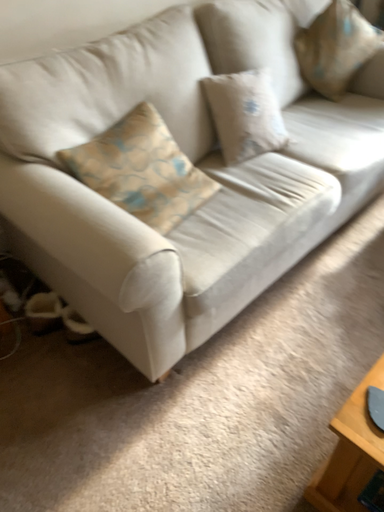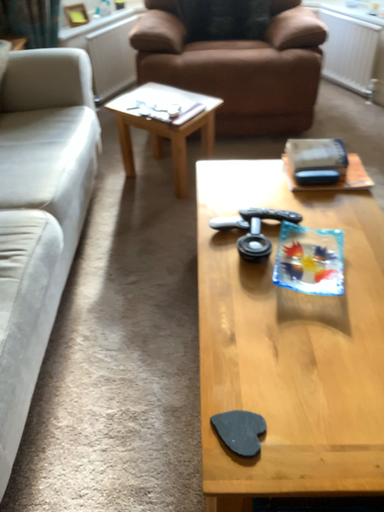
Question: How did the camera likely rotate when shooting the video?

Choices:
 (A) rotated right
 (B) rotated left

Answer: (A)